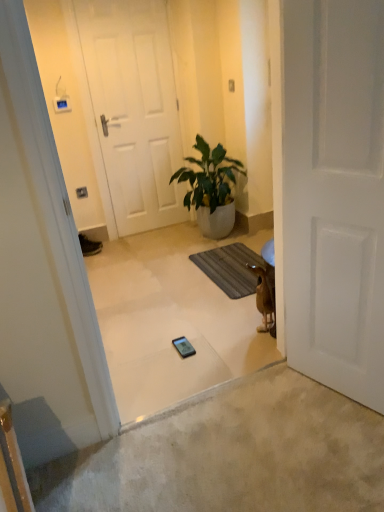
Question: From a real-world perspective, does green glossy plant at center sit lower than matte black phone at center?

Choices:
 (A) no
 (B) yes

Answer: (A)

Question: Is green glossy plant at center placed right next to matte black phone at center?

Choices:
 (A) no
 (B) yes

Answer: (A)

Question: Does green glossy plant at center have a lesser width compared to matte black phone at center?

Choices:
 (A) no
 (B) yes

Answer: (A)

Question: Is green glossy plant at center wider than matte black phone at center?

Choices:
 (A) yes
 (B) no

Answer: (A)

Question: From a real-world perspective, is green glossy plant at center positioned over matte black phone at center based on gravity?

Choices:
 (A) yes
 (B) no

Answer: (A)

Question: Does green glossy plant at center turn towards matte black phone at center?

Choices:
 (A) no
 (B) yes

Answer: (A)

Question: Can you confirm if matte black phone at center is taller than green glossy plant at center?

Choices:
 (A) yes
 (B) no

Answer: (B)

Question: Is matte black phone at center not close to green glossy plant at center?

Choices:
 (A) no
 (B) yes

Answer: (B)

Question: Is matte black phone at center thinner than green glossy plant at center?

Choices:
 (A) no
 (B) yes

Answer: (B)

Question: Does matte black phone at center come behind green glossy plant at center?

Choices:
 (A) no
 (B) yes

Answer: (A)

Question: Is green glossy plant at center inside matte black phone at center?

Choices:
 (A) yes
 (B) no

Answer: (B)

Question: Is matte black phone at center oriented towards green glossy plant at center?

Choices:
 (A) no
 (B) yes

Answer: (A)

Question: Does green glossy plant at center lie in front of brown furry dog at lower right?

Choices:
 (A) yes
 (B) no

Answer: (B)